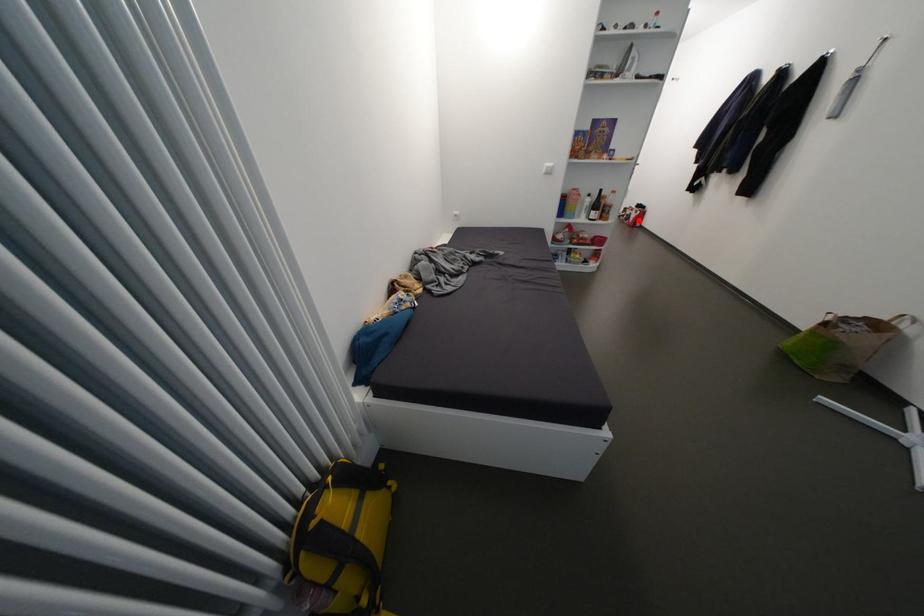
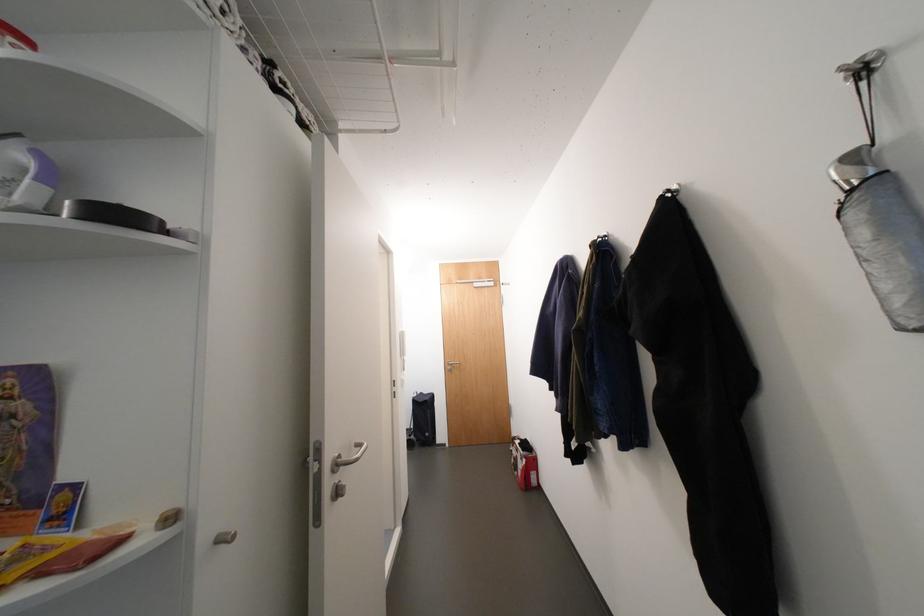
Locate, in the second image, the point that corresponds to the highlighted location in the first image.

(527, 474)